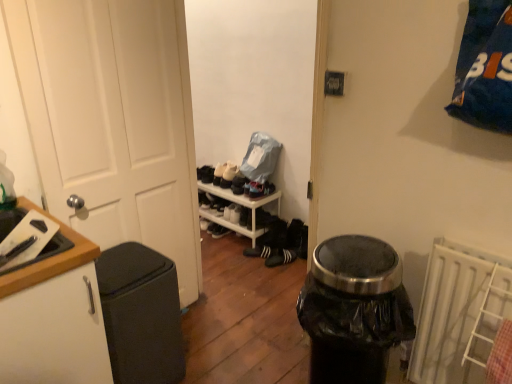
Where is `empty space that is ontop of black suede sneakers at center, which is the 2th footwear in left-to-right order (from a real-world perspective)`? This screenshot has height=384, width=512. empty space that is ontop of black suede sneakers at center, which is the 2th footwear in left-to-right order (from a real-world perspective) is located at coordinates (274, 246).